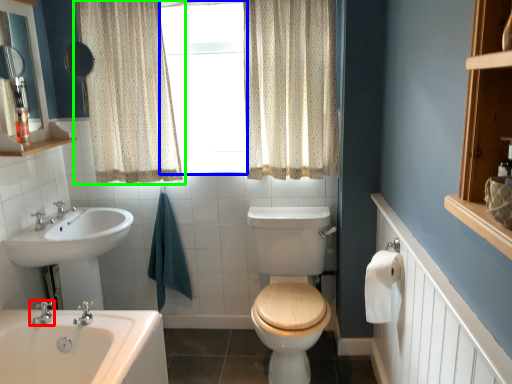
Question: Which object is the farthest from tap (highlighted by a red box)? Choose among these: window frame (highlighted by a blue box) or curtain (highlighted by a green box).

Choices:
 (A) window frame
 (B) curtain

Answer: (A)